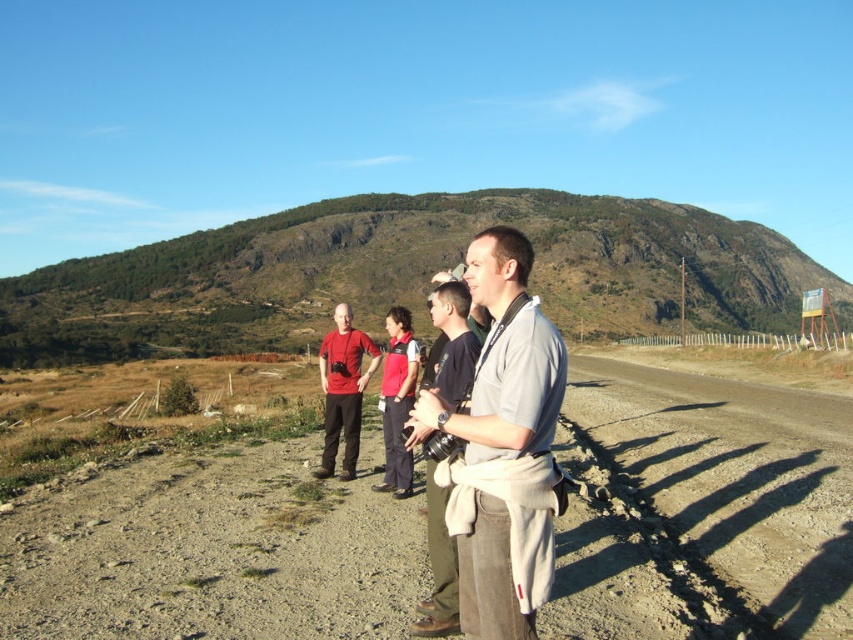
Does dirt road at lower right appear on the right side of matte red shirt at center?

Yes, dirt road at lower right is to the right of matte red shirt at center.

Who is more forward, (x=851, y=637) or (x=334, y=404)?

Point (x=851, y=637)

This screenshot has width=853, height=640. Find the location of `dirt road at lower right`. dirt road at lower right is located at coordinates (735, 481).

Who is more distant from viewer, (535, 332) or (425, 484)?

The point (425, 484) is behind.

You are a GUI agent. You are given a task and a screenshot of the screen. Output one action in this format:
    pyautogui.click(x=<x>, y=<y>)
    Task: Click on the gray cotton shirt at center
    
    Given the screenshot: What is the action you would take?
    pyautogui.click(x=503, y=445)

Who is more forward, (547, 520) or (437, 321)?

Point (547, 520) is more forward.

Where is `gray cotton shirt at center`? This screenshot has height=640, width=853. gray cotton shirt at center is located at coordinates point(503,445).

Is dirt track at center in front of gray cotton shirt at center?

No, it is behind gray cotton shirt at center.

Which is in front, point (790, 618) or point (556, 332)?

Positioned in front is point (556, 332).

Is point (357, 580) positioned in front of point (512, 554)?

No, (357, 580) is further to viewer.

Locate an element on the screen. This screenshot has width=853, height=640. dirt track at center is located at coordinates (701, 508).